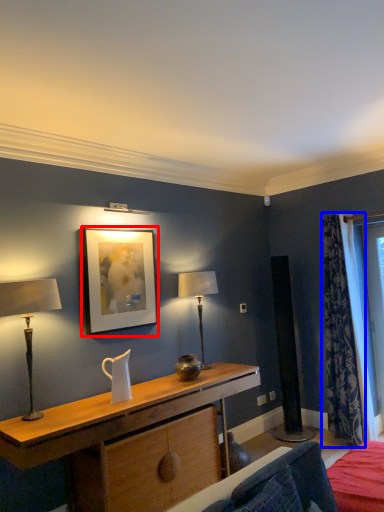
Question: Among these objects, which one is nearest to the camera, picture frame (highlighted by a red box) or curtain (highlighted by a blue box)?

Choices:
 (A) picture frame
 (B) curtain

Answer: (A)